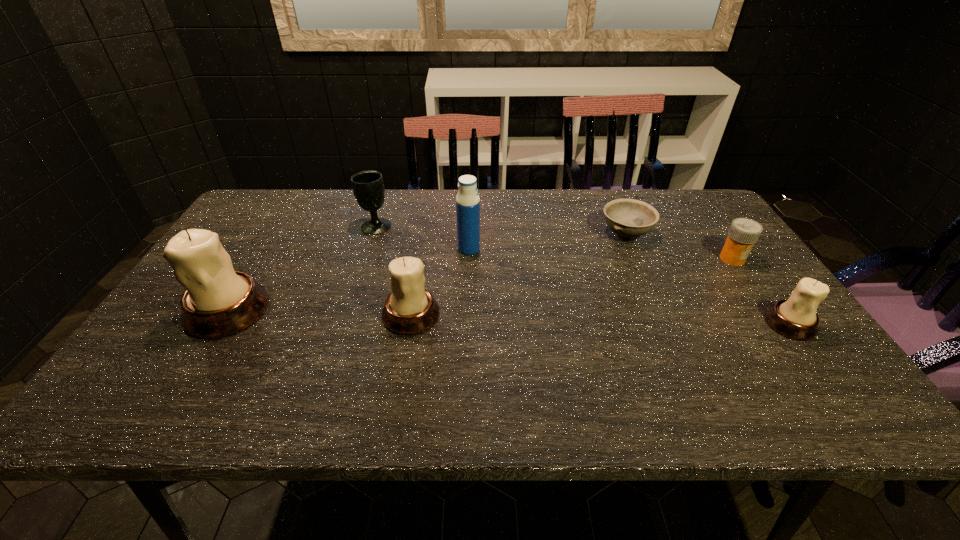
The width and height of the screenshot is (960, 540). In order to click on medicine in this screenshot , I will do `click(743, 233)`.

You are a GUI agent. You are given a task and a screenshot of the screen. Output one action in this format:
    pyautogui.click(x=<x>, y=<y>)
    Task: Click on the vacant space situated on the left of the third object from left to right
    The width and height of the screenshot is (960, 540).
    Given the screenshot: What is the action you would take?
    pyautogui.click(x=296, y=315)

I want to click on vacant space located on the back of the third shortest object, so click(x=754, y=273).

The image size is (960, 540). In order to click on free location located on the right of the second object from left to right in this screenshot , I will do `click(508, 226)`.

Locate an element on the screen. vacant region located 0.270m on the left of the water bottle is located at coordinates (364, 249).

This screenshot has height=540, width=960. I want to click on vacant space located on the back of the shortest object, so click(x=614, y=207).

What are the coordinates of `vacant space located on the label side of the sixth tallest object` in the screenshot? It's located at (768, 311).

At what (x,y) coordinates should I click in order to perform the action: click on chalice that is at the far edge. Please return your answer as a coordinate pair (x, y). This screenshot has height=540, width=960. Looking at the image, I should click on (368, 188).

You are a GUI agent. You are given a task and a screenshot of the screen. Output one action in this format:
    pyautogui.click(x=<x>, y=<y>)
    Task: Click on the bowl positioned at the far edge
    This screenshot has width=960, height=540.
    Given the screenshot: What is the action you would take?
    pyautogui.click(x=629, y=218)

Locate an element on the screen. Image resolution: width=960 pixels, height=540 pixels. object located at the left edge is located at coordinates (219, 301).